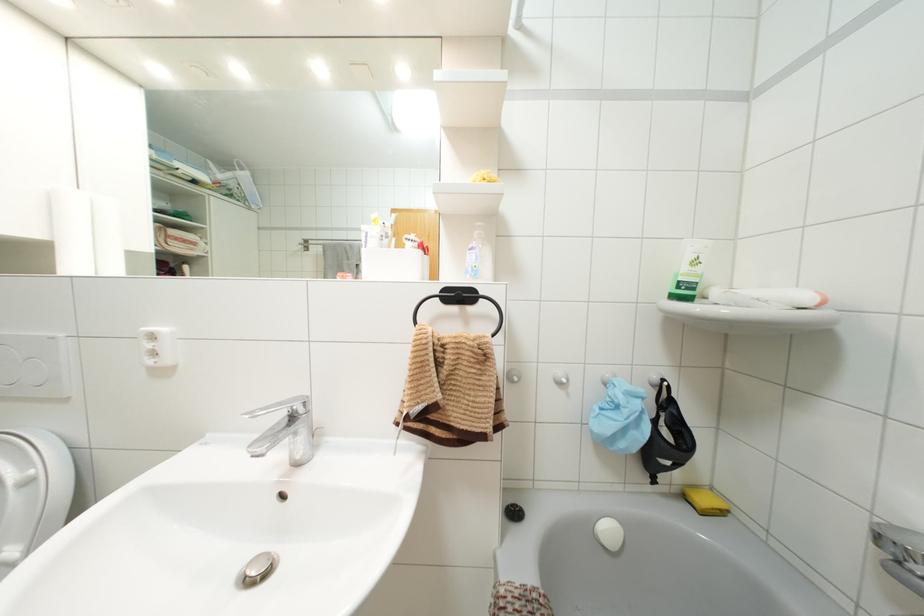
What do you see at coordinates (477, 224) in the screenshot? I see `the soap dispenser pump` at bounding box center [477, 224].